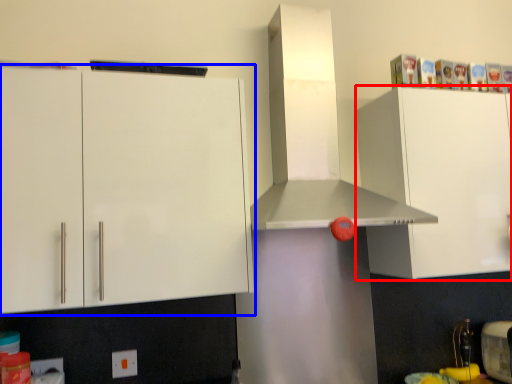
Question: Which object appears farthest to the camera in this image, cabinetry (highlighted by a red box) or cabinetry (highlighted by a blue box)?

Choices:
 (A) cabinetry
 (B) cabinetry

Answer: (A)